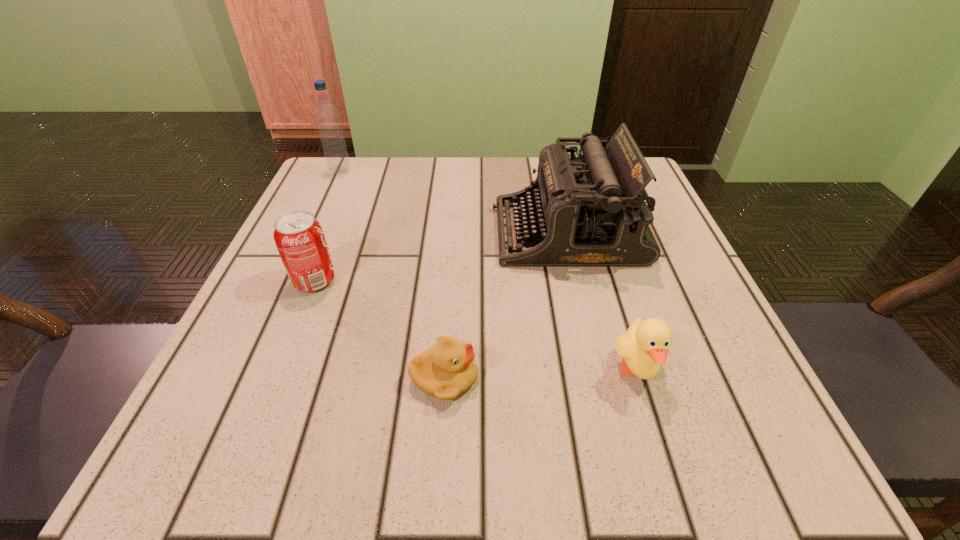
Where is `vacant area that lies between the farthest object and the soda`? This screenshot has height=540, width=960. vacant area that lies between the farthest object and the soda is located at coordinates (327, 226).

Identify the location of free spot between the taller duckling and the soda. The height and width of the screenshot is (540, 960). (475, 326).

What are the coordinates of `free space between the third object from left to right and the soda` in the screenshot? It's located at (379, 329).

Identify the location of vacant point located between the soda and the right duckling. (475, 326).

This screenshot has width=960, height=540. Identify the location of free space between the water bottle and the shorter duckling. (393, 275).

Locate an element on the screen. Image resolution: width=960 pixels, height=540 pixels. vacant area that lies between the farthest object and the typewriter is located at coordinates (454, 202).

Where is `vacant area that lies between the soda and the water bottle`? The image size is (960, 540). vacant area that lies between the soda and the water bottle is located at coordinates (327, 226).

Where is `free spot between the farthest object and the soda`? free spot between the farthest object and the soda is located at coordinates (327, 226).

Locate an element on the screen. Image resolution: width=960 pixels, height=540 pixels. vacant area that lies between the left duckling and the right duckling is located at coordinates (540, 374).

Where is `empty location between the soda and the typewriter`? Image resolution: width=960 pixels, height=540 pixels. empty location between the soda and the typewriter is located at coordinates (441, 256).